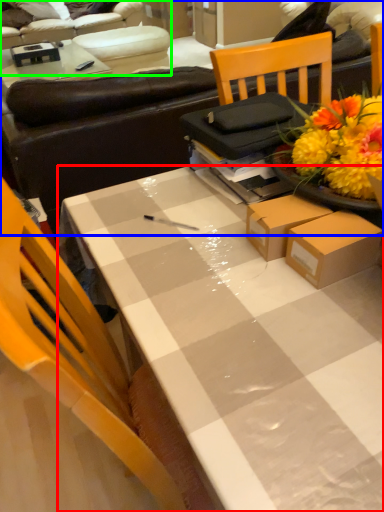
Question: Which object is the closest to the desk (highlighted by a red box)? Choose among these: studio couch (highlighted by a blue box) or studio couch (highlighted by a green box).

Choices:
 (A) studio couch
 (B) studio couch

Answer: (A)